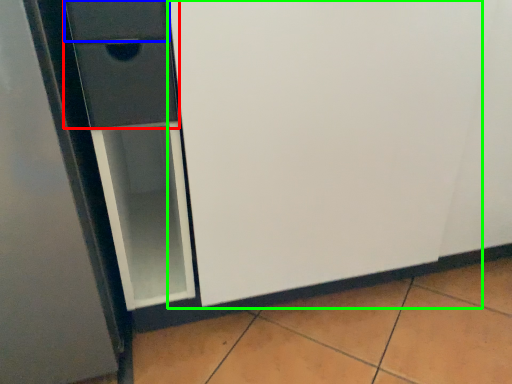
Question: Which object is positioned closest to drawer (highlighted by a red box)? Select from drawer (highlighted by a blue box) and screen door (highlighted by a green box).

Choices:
 (A) drawer
 (B) screen door

Answer: (A)